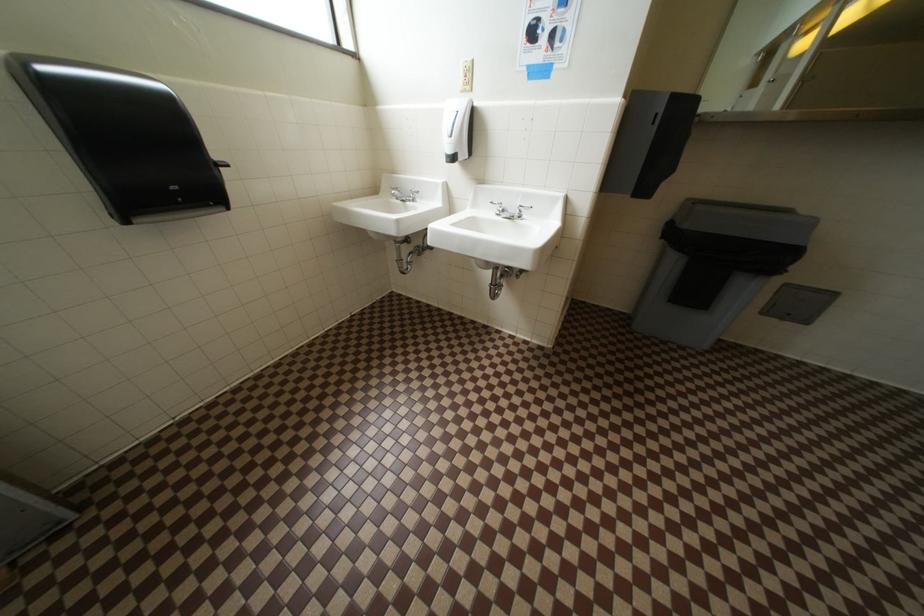
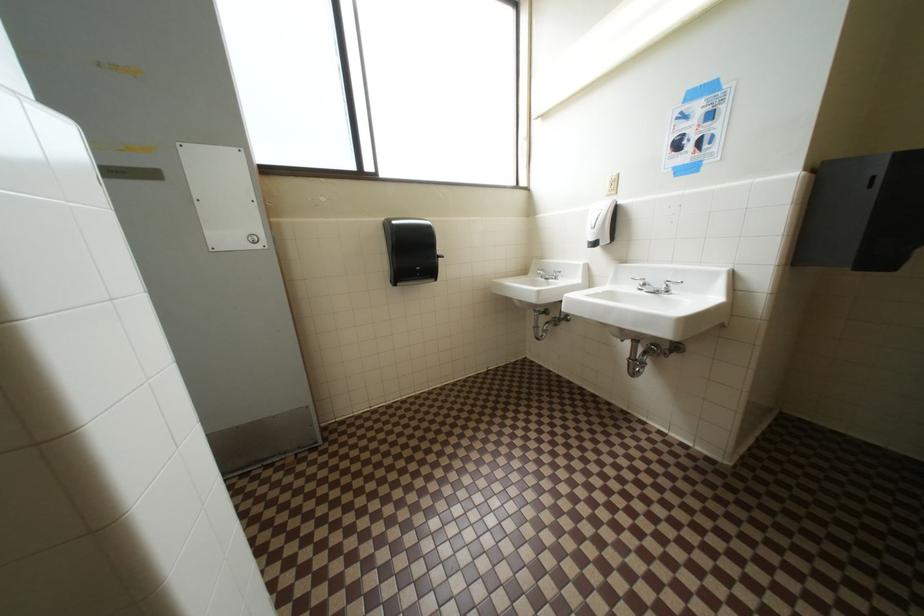
Question: Based on the continuous images, in which direction is the camera rotating? Reply with the corresponding letter.

Choices:
 (A) Left
 (B) Right
 (C) Up
 (D) Down

Answer: (A)